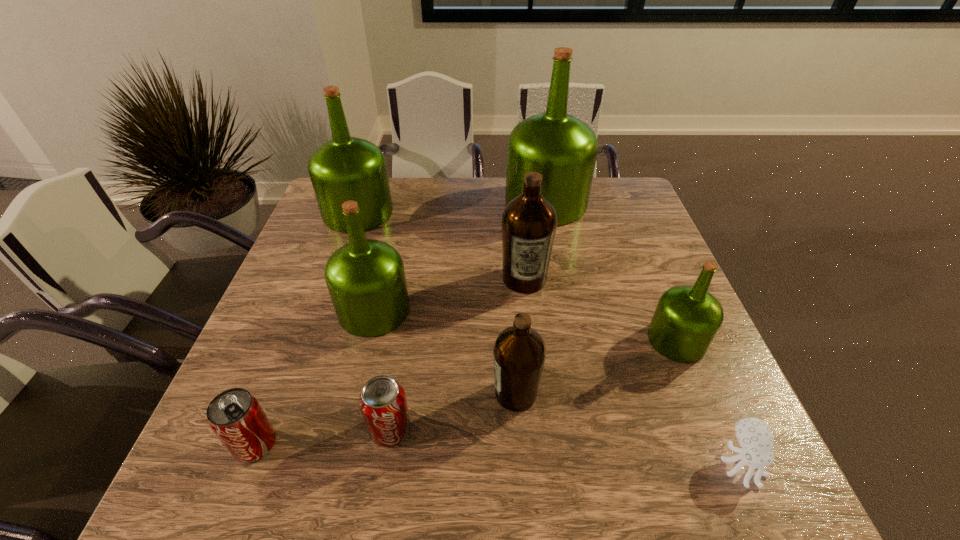
Locate an element on the screen. This screenshot has width=960, height=540. the tallest object is located at coordinates (563, 149).

You are a GUI agent. You are given a task and a screenshot of the screen. Output one action in this format:
    pyautogui.click(x=<x>, y=<y>)
    Task: Click on the tallest olive oil
    Image resolution: width=960 pixels, height=540 pixels.
    Given the screenshot: What is the action you would take?
    pyautogui.click(x=563, y=149)

Identify the location of the second biggest green olive oil. Image resolution: width=960 pixels, height=540 pixels. (345, 168).

Locate an element on the screen. This screenshot has height=540, width=960. the eighth shortest object is located at coordinates (345, 168).

Where is `the bigger brown olive oil`? The width and height of the screenshot is (960, 540). the bigger brown olive oil is located at coordinates (529, 222).

The image size is (960, 540). I want to click on the third biggest green olive oil, so click(x=365, y=278).

Find the location of a particular element. The image size is (960, 540). the rightmost green olive oil is located at coordinates (687, 318).

I want to click on the smallest green olive oil, so click(687, 318).

Find the location of a particular element. The height and width of the screenshot is (540, 960). the nearest olive oil is located at coordinates (519, 353).

Where is `the nearer brown olive oil`? The height and width of the screenshot is (540, 960). the nearer brown olive oil is located at coordinates (519, 353).